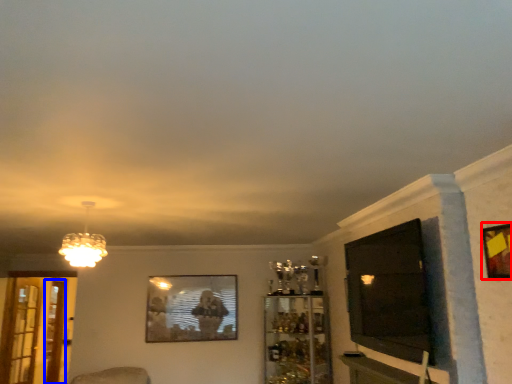
Question: Which of the following is the farthest to the observer, picture frame (highlighted by a red box) or screen door (highlighted by a blue box)?

Choices:
 (A) picture frame
 (B) screen door

Answer: (B)